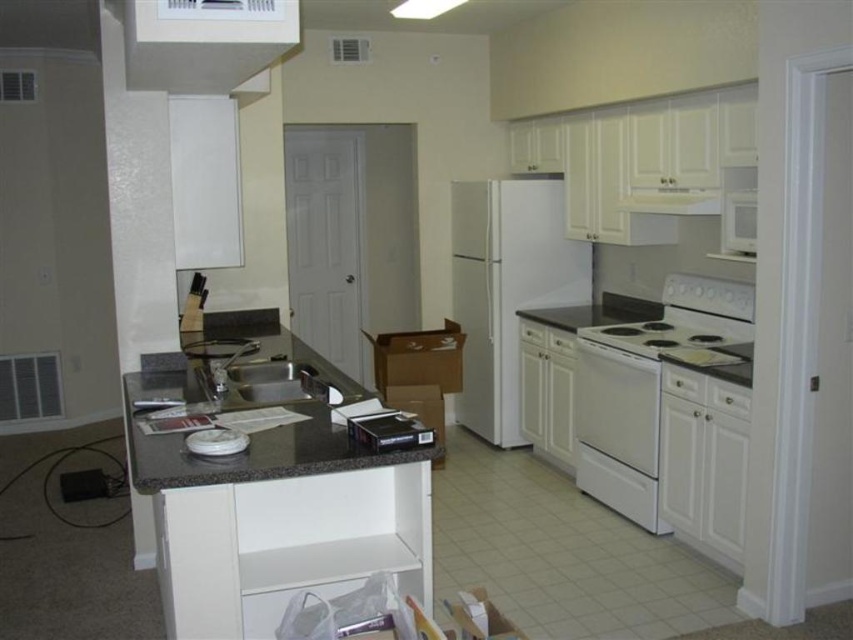
Question: Which point appears farthest from the camera in this image?

Choices:
 (A) (241, 369)
 (B) (669, 346)

Answer: (B)

Question: Is white glossy electric stove at center-right smaller than satin silver sink at center?

Choices:
 (A) no
 (B) yes

Answer: (A)

Question: Can you confirm if white glossy electric stove at center-right is bigger than white glossy electric stove at lower right?

Choices:
 (A) yes
 (B) no

Answer: (A)

Question: Which object is closer to the camera taking this photo?

Choices:
 (A) satin silver sink at center
 (B) white glossy exhaust hood at upper center
 (C) white glossy oven at lower right

Answer: (B)

Question: Can you confirm if white glossy electric stove at lower right is positioned to the right of satin silver sink at center?

Choices:
 (A) no
 (B) yes

Answer: (B)

Question: Which object is the farthest from the white glossy electric stove at center-right?

Choices:
 (A) white glossy oven at lower right
 (B) granite gray counter top at center

Answer: (B)